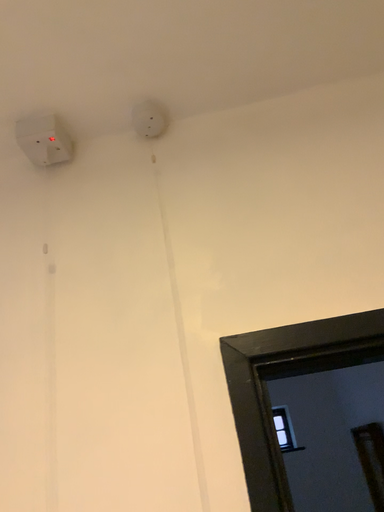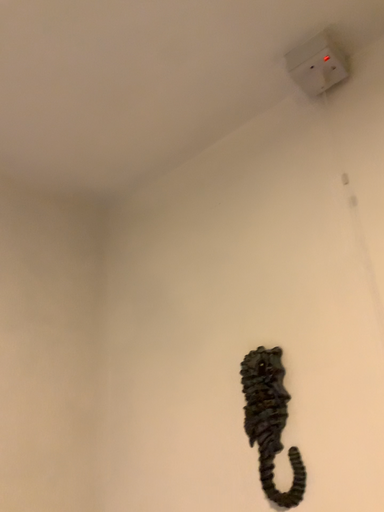
Question: Which way did the camera rotate in the video?

Choices:
 (A) rotated left
 (B) rotated right

Answer: (A)